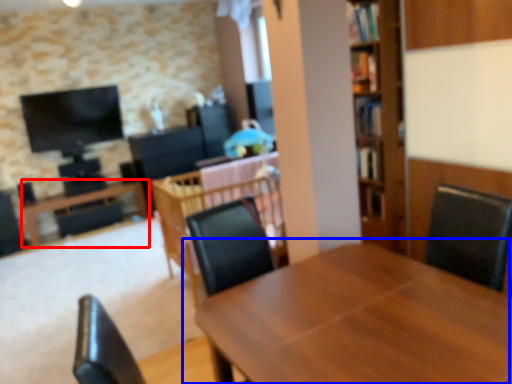
Question: Among these objects, which one is nearest to the camera, table (highlighted by a red box) or table (highlighted by a blue box)?

Choices:
 (A) table
 (B) table

Answer: (B)